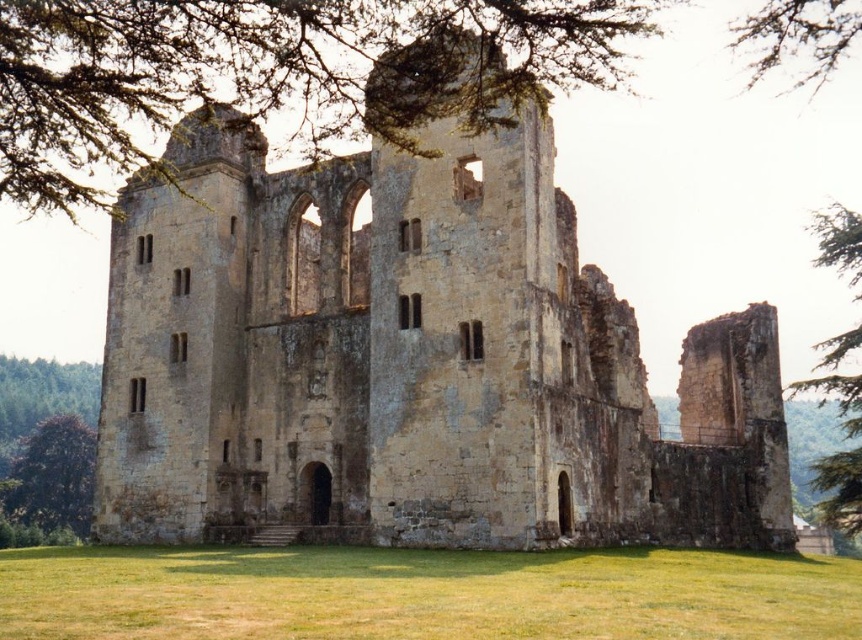
You are an archaeologist examining the ruins. You notice the yellow stone ruins at center and the green leafy tree at upper right. Which object is positioned to the left of the other?

The yellow stone ruins at center are positioned to the left of the green leafy tree at upper right.

You are standing in front of the medieval stone structure ruins and want to take a photo of the green leafy tree at upper left. Which direction should you face to capture it in the frame?

The green leafy tree at upper left is located at the upper left position, so you should face towards the upper left direction to capture it in the frame.